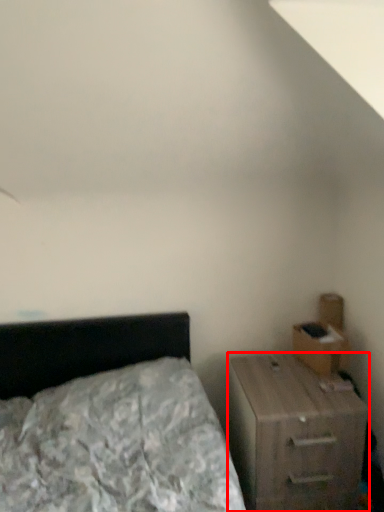
Question: From the image's perspective, what is the correct spatial relationship of nightstand (annotated by the red box) in relation to drawer?

Choices:
 (A) above
 (B) below

Answer: (B)